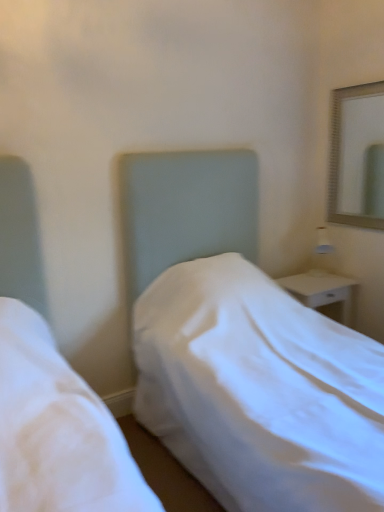
Question: Can you confirm if white glossy nightstand at right is thinner than white fabric bed at center?

Choices:
 (A) no
 (B) yes

Answer: (B)

Question: Is white glossy nightstand at right closer to camera compared to white fabric bed at center?

Choices:
 (A) no
 (B) yes

Answer: (A)

Question: Can you confirm if white glossy nightstand at right is smaller than white fabric bed at center?

Choices:
 (A) yes
 (B) no

Answer: (A)

Question: Does white glossy nightstand at right lie behind white fabric bed at center?

Choices:
 (A) no
 (B) yes

Answer: (B)

Question: Does white glossy nightstand at right have a larger size compared to white fabric bed at center?

Choices:
 (A) yes
 (B) no

Answer: (B)

Question: In the image, is silver metallic mirror at upper right positioned in front of or behind white fabric bed at center?

Choices:
 (A) front
 (B) behind

Answer: (B)

Question: From the image's perspective, is silver metallic mirror at upper right located above or below white fabric bed at center?

Choices:
 (A) below
 (B) above

Answer: (B)

Question: From a real-world perspective, is silver metallic mirror at upper right positioned above or below white fabric bed at center?

Choices:
 (A) above
 (B) below

Answer: (A)

Question: Visually, is silver metallic mirror at upper right positioned to the left or to the right of white fabric bed at center?

Choices:
 (A) right
 (B) left

Answer: (A)

Question: From a real-world perspective, is white fabric bed at center positioned above or below white glossy nightstand at right?

Choices:
 (A) above
 (B) below

Answer: (A)

Question: From the image's perspective, is white fabric bed at center located above or below white glossy nightstand at right?

Choices:
 (A) above
 (B) below

Answer: (A)

Question: Considering the positions of point (268, 339) and point (327, 296), is point (268, 339) closer or farther from the camera than point (327, 296)?

Choices:
 (A) closer
 (B) farther

Answer: (A)

Question: Based on their sizes in the image, would you say white fabric bed at center is bigger or smaller than white glossy nightstand at right?

Choices:
 (A) big
 (B) small

Answer: (A)

Question: From the image's perspective, is white fabric bed at center located above or below silver metallic mirror at upper right?

Choices:
 (A) above
 (B) below

Answer: (B)

Question: Looking at the image, does white fabric bed at center seem bigger or smaller compared to silver metallic mirror at upper right?

Choices:
 (A) big
 (B) small

Answer: (A)